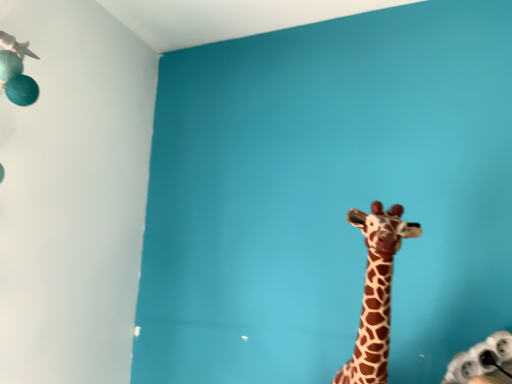
The height and width of the screenshot is (384, 512). In order to click on brown spotted plush at center in this screenshot , I will do `click(376, 292)`.

What do you see at coordinates (376, 292) in the screenshot?
I see `brown spotted plush at center` at bounding box center [376, 292].

What is the approximate height of brown spotted plush at center?

brown spotted plush at center is 14.93 inches in height.

Find the location of a particular element. brown spotted plush at center is located at coordinates (376, 292).